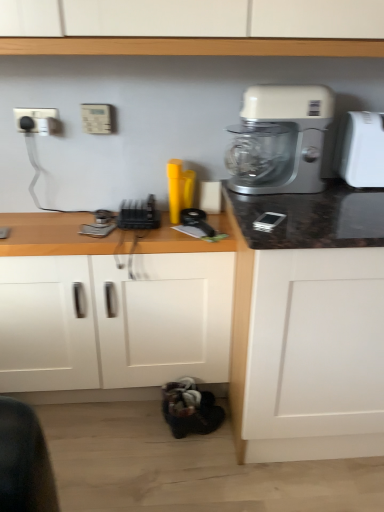
Question: From a real-world perspective, is white plastic mixer at upper right beneath beige plastic electric outlet at upper center, which is counted as the second electric outlet, starting from the left?

Choices:
 (A) yes
 (B) no

Answer: (A)

Question: Is white plastic mixer at upper right wider than beige plastic electric outlet at upper center, the first electric outlet when ordered from right to left?

Choices:
 (A) yes
 (B) no

Answer: (A)

Question: Is beige plastic electric outlet at upper center, the first electric outlet when ordered from right to left, located within white plastic mixer at upper right?

Choices:
 (A) yes
 (B) no

Answer: (B)

Question: From the image's perspective, does white plastic mixer at upper right appear higher than beige plastic electric outlet at upper center, the first electric outlet when ordered from right to left?

Choices:
 (A) yes
 (B) no

Answer: (B)

Question: From the image's perspective, is white plastic mixer at upper right located beneath beige plastic electric outlet at upper center, the first electric outlet when ordered from right to left?

Choices:
 (A) yes
 (B) no

Answer: (A)

Question: Is white plastic mixer at upper right bigger than beige plastic electric outlet at upper center, the first electric outlet when ordered from right to left?

Choices:
 (A) yes
 (B) no

Answer: (A)

Question: Considering the relative sizes of white plastic mixer at upper right and black plastic toaster at center in the image provided, is white plastic mixer at upper right thinner than black plastic toaster at center?

Choices:
 (A) yes
 (B) no

Answer: (A)

Question: Considering the relative sizes of white plastic mixer at upper right and black plastic toaster at center in the image provided, is white plastic mixer at upper right bigger than black plastic toaster at center?

Choices:
 (A) no
 (B) yes

Answer: (B)

Question: Is white plastic mixer at upper right oriented towards black plastic toaster at center?

Choices:
 (A) yes
 (B) no

Answer: (B)

Question: From a real-world perspective, is white plastic mixer at upper right on top of black plastic toaster at center?

Choices:
 (A) no
 (B) yes

Answer: (B)

Question: Is white plastic mixer at upper right taller than black plastic toaster at center?

Choices:
 (A) yes
 (B) no

Answer: (A)

Question: Can black plastic toaster at center be found inside white plastic mixer at upper right?

Choices:
 (A) yes
 (B) no

Answer: (B)

Question: From the image's perspective, is beige plastic electric outlet at upper center, which is counted as the second electric outlet, starting from the left, located above white plastic electric outlet at upper left, positioned as the 2th electric outlet in right-to-left order?

Choices:
 (A) no
 (B) yes

Answer: (A)